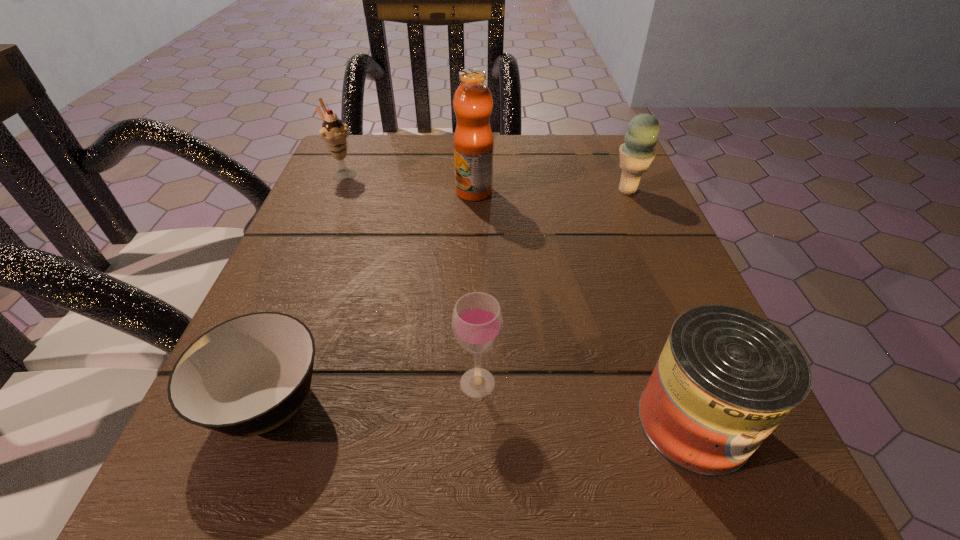
Identify which object is the second closest to the left ice cream. Please provide its 2D coordinates. Your answer should be formatted as a tuple, i.e. [(x, y)], where the tuple contains the x and y coordinates of a point satisfying the conditions above.

[(248, 375)]

This screenshot has width=960, height=540. I want to click on object that is the third nearest to the left ice cream, so click(x=477, y=320).

Locate an element on the screen. This screenshot has width=960, height=540. free space that satisfies the following two spatial constraints: 1. on the front side of the can; 2. on the right side of the tallest object is located at coordinates (470, 422).

Where is `free region that satisfies the following two spatial constraints: 1. on the front side of the shortest object; 2. on the right side of the left ice cream`? free region that satisfies the following two spatial constraints: 1. on the front side of the shortest object; 2. on the right side of the left ice cream is located at coordinates (247, 403).